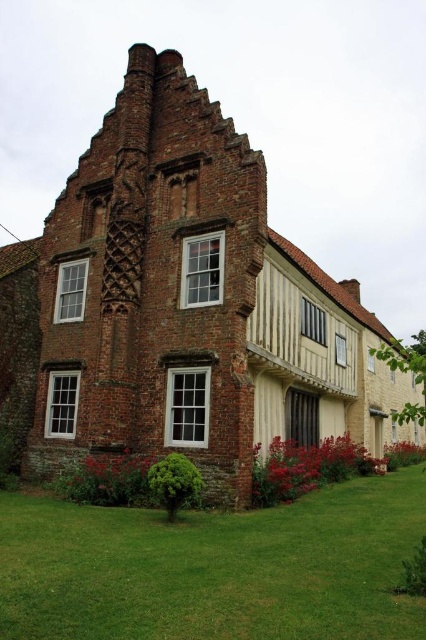
You are standing in front of a historic building and see green grass at lower center and vivid red petals at lower left. Which object is closer to the ground?

The green grass at lower center is closer to the ground since it is positioned below the vivid red petals at lower left.

You are standing in front of a historic building and notice two points marked on its gable end. The first point is at coordinates point [393,609] and the second is at point [316,486]. Which of these points is nearer to you?

Point [393,609] is closer to the viewer than point [316,486].

Looking at this image, you are standing in front of the historic building and notice two elements at the base of the structure. The green grass at lower center and the vivid red petals at lower left. Which of these two elements is positioned to the right when viewed from the front of the building?

The green grass at lower center is positioned to the right of the vivid red petals at lower left.